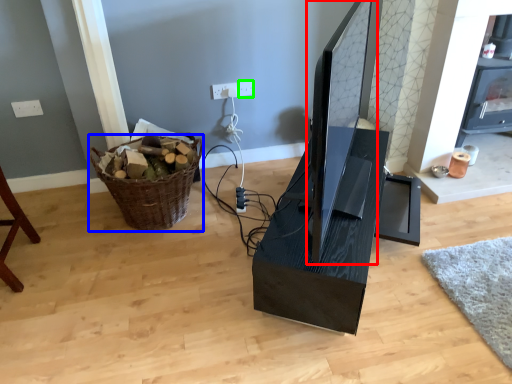
Question: Which object is the farthest from computer monitor (highlighted by a red box)? Choose among these: basket (highlighted by a blue box) or electric outlet (highlighted by a green box).

Choices:
 (A) basket
 (B) electric outlet

Answer: (A)